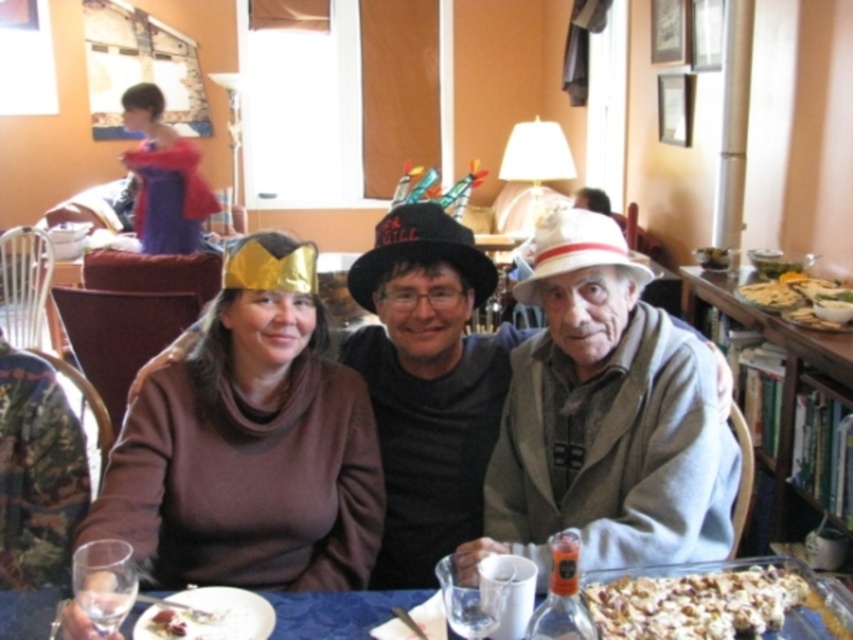
Question: Can you confirm if gray woolen sweater at center is thinner than crusty bread at right?

Choices:
 (A) yes
 (B) no

Answer: (B)

Question: Which of these objects is positioned farthest from the crusty bread at right?

Choices:
 (A) brown soft sweater at center
 (B) gray woolen sweater at center
 (C) blue fabric table at lower center
 (D) brown matte hat at left

Answer: (D)

Question: Which object appears closest to the camera in this image?

Choices:
 (A) brown matte hat at left
 (B) blue fabric table at lower center
 (C) brown soft sweater at center
 (D) gray woolen sweater at center

Answer: (B)

Question: Can you confirm if brown matte hat at left is positioned below brown soft sweater at center?

Choices:
 (A) yes
 (B) no

Answer: (A)

Question: Which point appears farthest from the camera in this image?

Choices:
 (A) (590, 451)
 (B) (387, 296)

Answer: (B)

Question: Is gray woolen sweater at center behind crumbly brown popcorn at lower right?

Choices:
 (A) yes
 (B) no

Answer: (A)